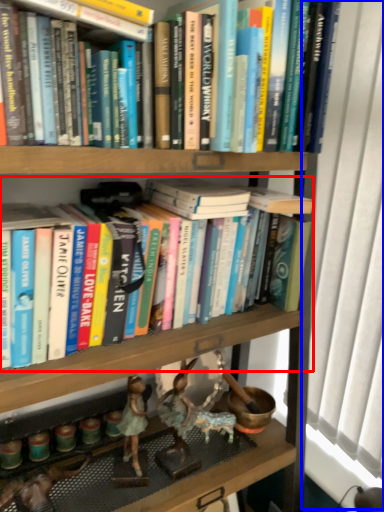
Question: Among these objects, which one is farthest to the camera, book (highlighted by a red box) or window screen (highlighted by a blue box)?

Choices:
 (A) book
 (B) window screen

Answer: (B)